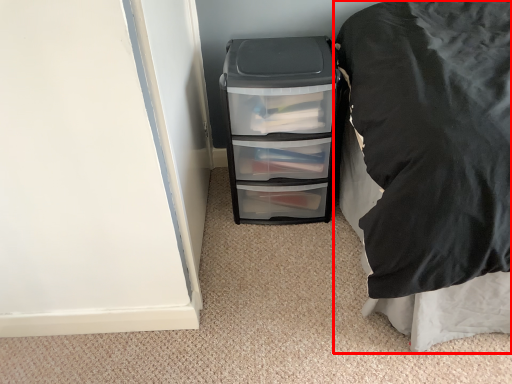
Question: From the image's perspective, what is the correct spatial positioning of furniture (annotated by the red box) in reference to file cabinet?

Choices:
 (A) below
 (B) above

Answer: (A)